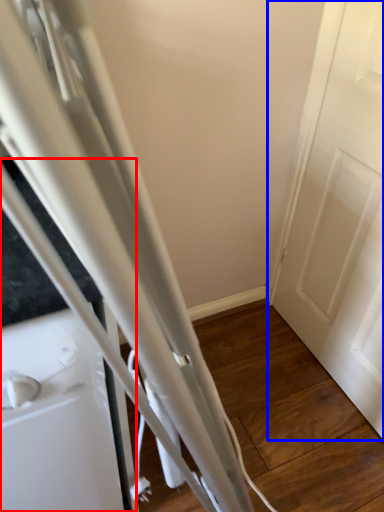
Question: Which object is closer to the camera taking this photo, appliance (highlighted by a red box) or door (highlighted by a blue box)?

Choices:
 (A) appliance
 (B) door

Answer: (A)